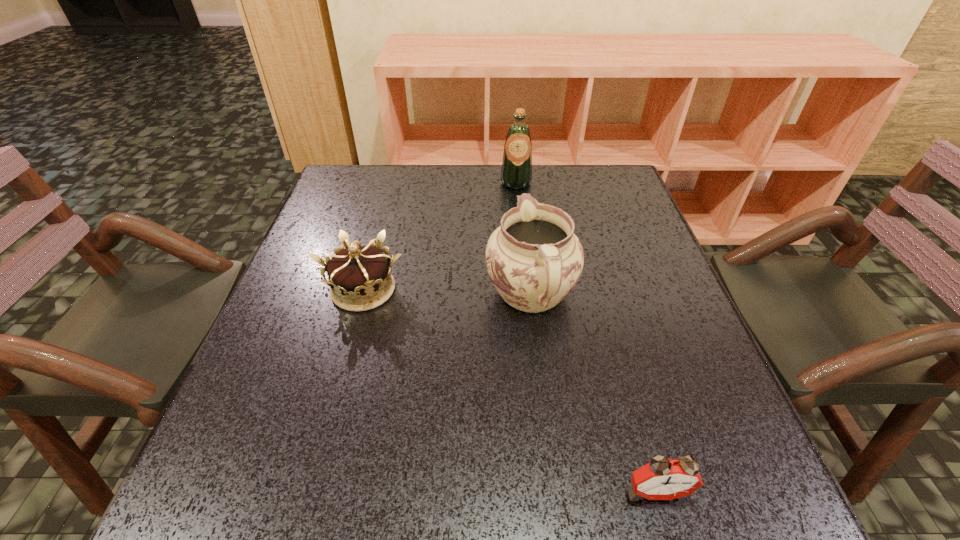
Identify the location of object that is at the far edge. The height and width of the screenshot is (540, 960). (516, 173).

Find the location of a particular element. object at the near edge is located at coordinates (662, 478).

Image resolution: width=960 pixels, height=540 pixels. I want to click on object that is positioned at the left edge, so coord(360,279).

This screenshot has width=960, height=540. I want to click on object present at the right edge, so click(662, 478).

You are a GUI agent. You are given a task and a screenshot of the screen. Output one action in this format:
    pyautogui.click(x=<x>, y=<y>)
    Task: Click on the object that is at the near right corner
    This screenshot has width=960, height=540.
    Given the screenshot: What is the action you would take?
    pyautogui.click(x=662, y=478)

Find the location of `free space at the far edge`. free space at the far edge is located at coordinates point(544,195).

You are a GUI agent. You are given a task and a screenshot of the screen. Output one action in this format:
    pyautogui.click(x=<x>, y=<y>)
    Task: Click on the free space at the left edge of the desktop
    
    Given the screenshot: What is the action you would take?
    pyautogui.click(x=304, y=451)

Where is `free space at the right edge of the desktop`? The width and height of the screenshot is (960, 540). free space at the right edge of the desktop is located at coordinates (647, 359).

The image size is (960, 540). In the image, there is a desktop. Find the location of `free region at the far left corner`. free region at the far left corner is located at coordinates (339, 177).

Locate an element on the screen. This screenshot has height=540, width=960. vacant space at the near left corner is located at coordinates (261, 469).